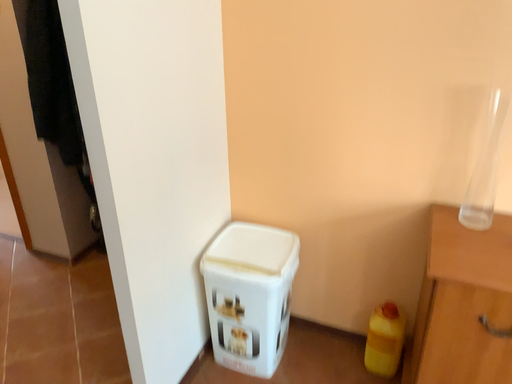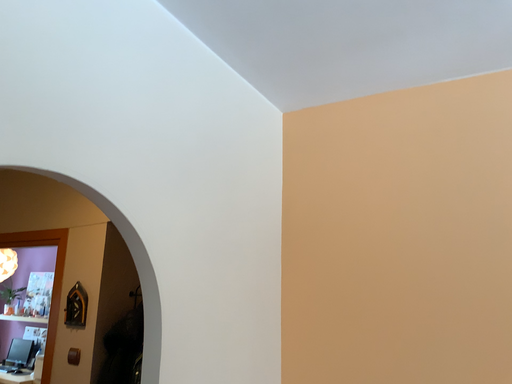
Question: Which way did the camera rotate in the video?

Choices:
 (A) rotated upward
 (B) rotated downward

Answer: (A)